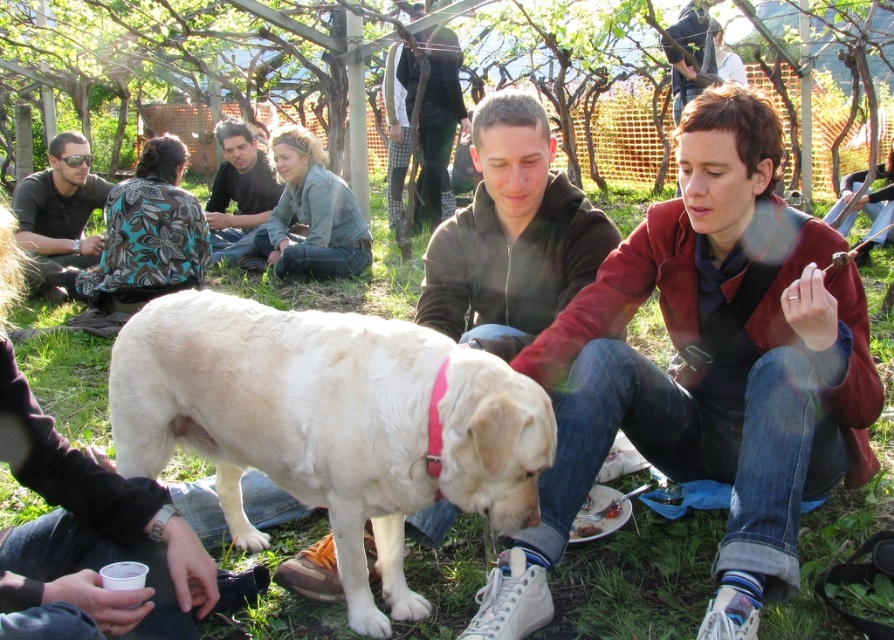
Does light beige fur at center have a smaller size compared to matte black jacket at upper left?

Yes, light beige fur at center is smaller than matte black jacket at upper left.

Does light beige fur at center lie behind matte black jacket at upper left?

No, light beige fur at center is closer to the viewer.

Is point (217, 346) positioned in front of point (81, 209)?

Yes, point (217, 346) is in front of point (81, 209).

The width and height of the screenshot is (894, 640). In order to click on light beige fur at center in this screenshot , I will do (329, 422).

Is light beige fur at center smaller than smooth brown shirt at center?

Incorrect, light beige fur at center is not smaller in size than smooth brown shirt at center.

Which is more to the right, light beige fur at center or smooth brown shirt at center?

From the viewer's perspective, light beige fur at center appears more on the right side.

Does point (150, 467) come behind point (235, 227)?

No, (150, 467) is in front of (235, 227).

Locate an element on the screen. The width and height of the screenshot is (894, 640). light beige fur at center is located at coordinates (329, 422).

Which is in front, point (260, 333) or point (287, 602)?

Positioned in front is point (260, 333).

Does light beige fur at center appear on the left side of green grass at center?

Correct, you'll find light beige fur at center to the left of green grass at center.

Between point (225, 330) and point (336, 296), which one is positioned behind?

The point (336, 296) is behind.

Where is `light beige fur at center`? The width and height of the screenshot is (894, 640). light beige fur at center is located at coordinates (329, 422).